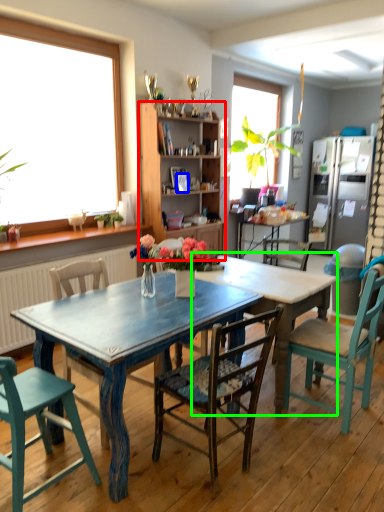
Question: Based on their relative distances, which object is nearer to cabinetry (highlighted by a red box)? Choose from picture frame (highlighted by a blue box) and table (highlighted by a green box).

Choices:
 (A) picture frame
 (B) table

Answer: (A)